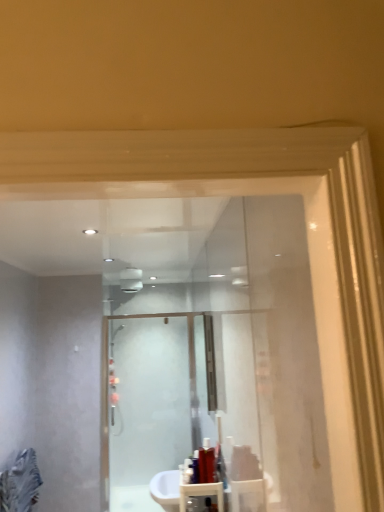
Question: Is the surface of shiny red bottle at lower center, marked as the first toiletry in a front-to-back arrangement, in direct contact with translucent plastic bottle at center, which is counted as the third toiletry, starting from the front?

Choices:
 (A) yes
 (B) no

Answer: (A)

Question: Can we say shiny red bottle at lower center, arranged as the second toiletry when viewed from the right, lies outside translucent plastic bottle at center, which is the third toiletry from left to right?

Choices:
 (A) no
 (B) yes

Answer: (B)

Question: Considering the relative positions of shiny red bottle at lower center, which appears as the second toiletry when viewed from the left, and translucent plastic bottle at center, marked as the first toiletry in a right-to-left arrangement, in the image provided, is shiny red bottle at lower center, which appears as the second toiletry when viewed from the left, in front of translucent plastic bottle at center, marked as the first toiletry in a right-to-left arrangement,?

Choices:
 (A) no
 (B) yes

Answer: (B)

Question: Does shiny red bottle at lower center, arranged as the second toiletry when viewed from the right, have a greater width compared to translucent plastic bottle at center, which is counted as the third toiletry, starting from the front?

Choices:
 (A) no
 (B) yes

Answer: (A)

Question: From a real-world perspective, is shiny red bottle at lower center, which appears as the second toiletry when viewed from the left, beneath translucent plastic bottle at center, which is the third toiletry from left to right?

Choices:
 (A) no
 (B) yes

Answer: (B)

Question: Is shiny red bottle at lower center, which appears as the second toiletry when viewed from the left, taller or shorter than frosted glass shower door at center?

Choices:
 (A) tall
 (B) short

Answer: (B)

Question: Considering the positions of point (195, 460) and point (132, 501), is point (195, 460) closer or farther from the camera than point (132, 501)?

Choices:
 (A) closer
 (B) farther

Answer: (A)

Question: From a real-world perspective, is shiny red bottle at lower center, the third toiletry positioned from the back, positioned above or below frosted glass shower door at center?

Choices:
 (A) below
 (B) above

Answer: (A)

Question: In terms of size, does shiny red bottle at lower center, the third toiletry positioned from the back, appear bigger or smaller than frosted glass shower door at center?

Choices:
 (A) big
 (B) small

Answer: (B)

Question: Is translucent plastic bottle at center, which appears as the first toiletry when viewed from the back, taller or shorter than shiny red bottle at lower center, arranged as the second toiletry when viewed from the right?

Choices:
 (A) tall
 (B) short

Answer: (A)

Question: Would you say translucent plastic bottle at center, marked as the first toiletry in a right-to-left arrangement, is to the left or to the right of shiny red bottle at lower center, the third toiletry positioned from the back, in the picture?

Choices:
 (A) left
 (B) right

Answer: (B)

Question: In terms of width, does translucent plastic bottle at center, marked as the first toiletry in a right-to-left arrangement, look wider or thinner when compared to shiny red bottle at lower center, arranged as the second toiletry when viewed from the right?

Choices:
 (A) thin
 (B) wide

Answer: (B)

Question: Considering the positions of translucent plastic bottle at center, which appears as the first toiletry when viewed from the back, and shiny red bottle at lower center, marked as the first toiletry in a front-to-back arrangement, in the image, is translucent plastic bottle at center, which appears as the first toiletry when viewed from the back, bigger or smaller than shiny red bottle at lower center, marked as the first toiletry in a front-to-back arrangement,?

Choices:
 (A) small
 (B) big

Answer: (B)

Question: From a real-world perspective, relative to frosted glass shower door at center, is translucent plastic bottle at center, marked as the first toiletry in a right-to-left arrangement, vertically above or below?

Choices:
 (A) below
 (B) above

Answer: (A)

Question: Do you think translucent plastic bottle at center, marked as the first toiletry in a right-to-left arrangement, is within frosted glass shower door at center, or outside of it?

Choices:
 (A) inside
 (B) outside

Answer: (B)